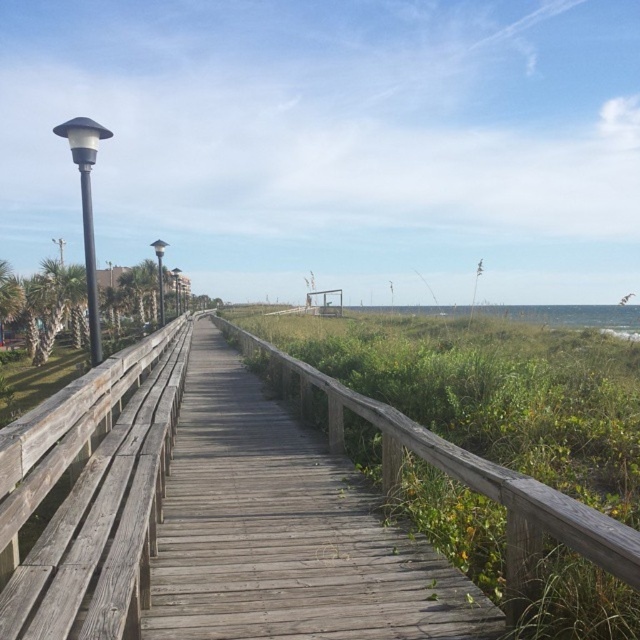
Question: Among these points, which one is nearest to the camera?

Choices:
 (A) (150, 422)
 (B) (397, 593)

Answer: (B)

Question: Does weathered wood boardwalk at center have a smaller size compared to weathered wood rail at left?

Choices:
 (A) no
 (B) yes

Answer: (B)

Question: Where is weathered wood boardwalk at center located in relation to weathered wood rail at left in the image?

Choices:
 (A) above
 (B) below

Answer: (B)

Question: Among these points, which one is nearest to the camera?

Choices:
 (A) (234, 422)
 (B) (33, 563)

Answer: (B)

Question: Can you confirm if weathered wood boardwalk at center is positioned above weathered wood rail at left?

Choices:
 (A) yes
 (B) no

Answer: (B)

Question: Among these points, which one is nearest to the camera?

Choices:
 (A) (161, 396)
 (B) (205, 385)

Answer: (A)